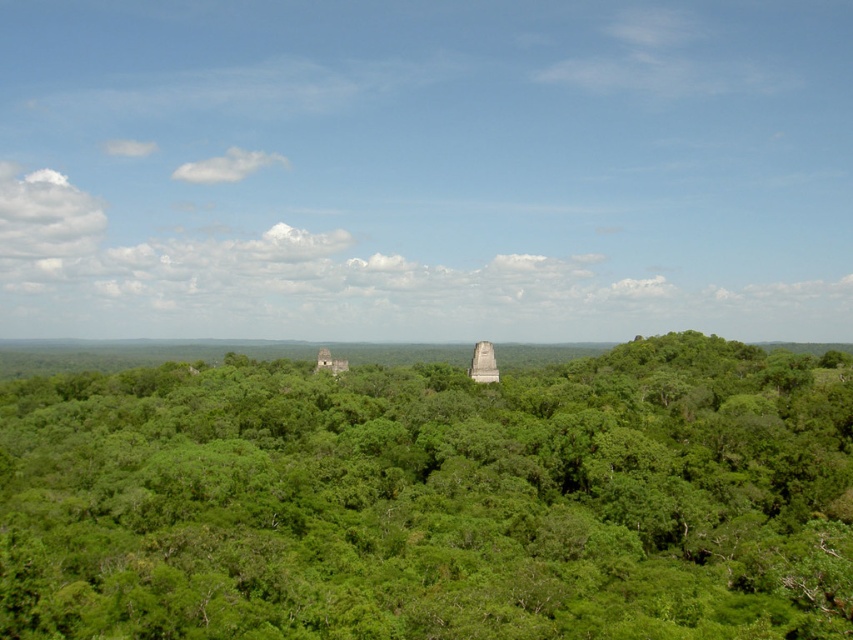
Question: Is green leafy trees at center further to camera compared to gray stone pyramid at center?

Choices:
 (A) yes
 (B) no

Answer: (B)

Question: Is smooth gray stone pyramid at center positioned before gray stone pyramid at center?

Choices:
 (A) yes
 (B) no

Answer: (A)

Question: Observing the image, what is the correct spatial positioning of green leafy trees at center in reference to smooth gray stone pyramid at center?

Choices:
 (A) below
 (B) above

Answer: (A)

Question: Among these points, which one is nearest to the camera?

Choices:
 (A) pyautogui.click(x=109, y=392)
 (B) pyautogui.click(x=321, y=349)
 (C) pyautogui.click(x=474, y=362)

Answer: (A)

Question: Which of these objects is positioned closest to the gray stone pyramid at center?

Choices:
 (A) smooth gray stone pyramid at center
 (B) green leafy trees at center

Answer: (A)

Question: Which point is closer to the camera taking this photo?

Choices:
 (A) (328, 365)
 (B) (248, 600)
 (C) (474, 346)

Answer: (B)